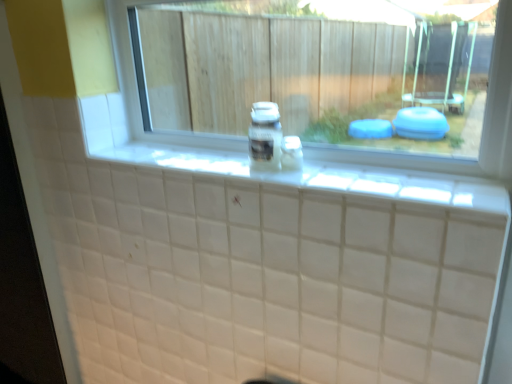
Question: Does point (118, 51) appear closer or farther from the camera than point (271, 144)?

Choices:
 (A) closer
 (B) farther

Answer: (B)

Question: From a real-world perspective, is transparent glass window at center above or below clear plastic bottle at center?

Choices:
 (A) above
 (B) below

Answer: (A)

Question: Based on their relative distances, which object is farther from the clear plastic bottle at center?

Choices:
 (A) transparent glass window at center
 (B) white tile ledge at center

Answer: (A)

Question: Considering the real-world distances, which object is closest to the clear plastic bottle at center?

Choices:
 (A) transparent glass window at center
 (B) white tile ledge at center

Answer: (B)